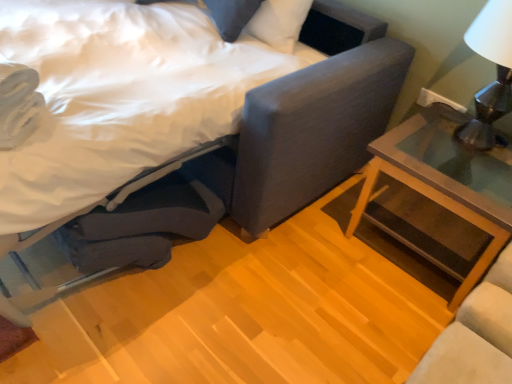
Question: Visually, is matte gray bed at center positioned to the left or to the right of clear glass nightstand at right?

Choices:
 (A) left
 (B) right

Answer: (A)

Question: In terms of width, does matte gray bed at center look wider or thinner when compared to clear glass nightstand at right?

Choices:
 (A) thin
 (B) wide

Answer: (B)

Question: Is point (300, 39) closer or farther from the camera than point (483, 230)?

Choices:
 (A) closer
 (B) farther

Answer: (B)

Question: Is point (433, 119) positioned closer to the camera than point (293, 208)?

Choices:
 (A) farther
 (B) closer

Answer: (B)

Question: Is clear glass nightstand at right to the left or to the right of matte gray bed at center in the image?

Choices:
 (A) left
 (B) right

Answer: (B)

Question: From their relative heights in the image, would you say clear glass nightstand at right is taller or shorter than matte gray bed at center?

Choices:
 (A) short
 (B) tall

Answer: (A)

Question: From the image's perspective, is clear glass nightstand at right positioned above or below matte gray bed at center?

Choices:
 (A) above
 (B) below

Answer: (B)